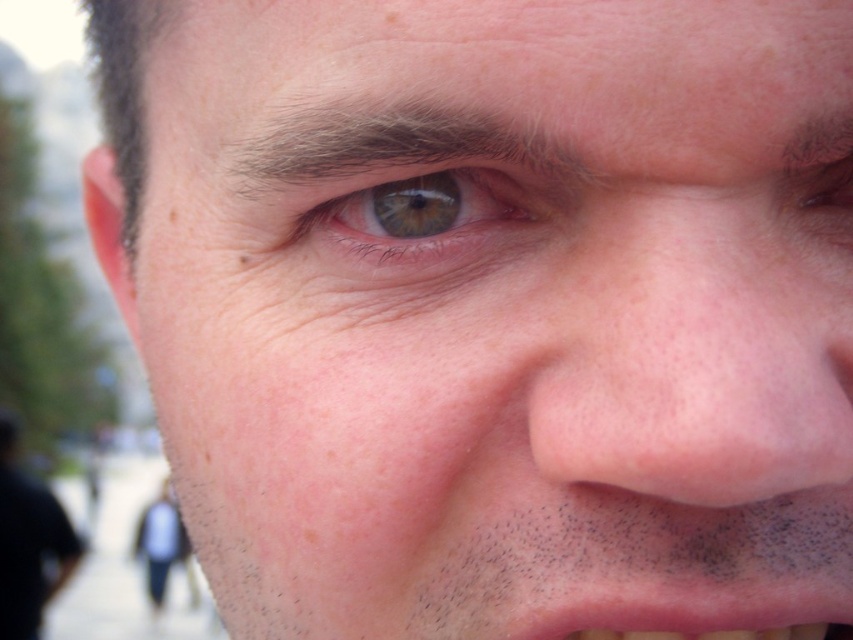
Between dry skin nose at center and green matte eye at upper center, which one appears on the right side from the viewer's perspective?

dry skin nose at center is more to the right.

Can you confirm if dry skin nose at center is wider than green matte eye at upper center?

Correct, the width of dry skin nose at center exceeds that of green matte eye at upper center.

Which is in front, point (757, 184) or point (526, 227)?

Point (757, 184) is in front.

You are a GUI agent. You are given a task and a screenshot of the screen. Output one action in this format:
    pyautogui.click(x=<x>, y=<y>)
    Task: Click on the dry skin nose at center
    
    Given the screenshot: What is the action you would take?
    pyautogui.click(x=698, y=342)

In the scene shown: Can you confirm if green matte eye at upper center is positioned below pink flesh-colored mouth at lower center?

No, green matte eye at upper center is not below pink flesh-colored mouth at lower center.

Can you confirm if green matte eye at upper center is wider than pink flesh-colored mouth at lower center?

In fact, green matte eye at upper center might be narrower than pink flesh-colored mouth at lower center.

Locate an element on the screen. Image resolution: width=853 pixels, height=640 pixels. green matte eye at upper center is located at coordinates (434, 212).

Describe the element at coordinates (698, 342) in the screenshot. The width and height of the screenshot is (853, 640). I see `dry skin nose at center` at that location.

Who is lower down, dry skin nose at center or pink flesh-colored mouth at lower center?

pink flesh-colored mouth at lower center is below.

Is point (730, 262) in front of point (621, 636)?

That is True.

I want to click on dry skin nose at center, so click(x=698, y=342).